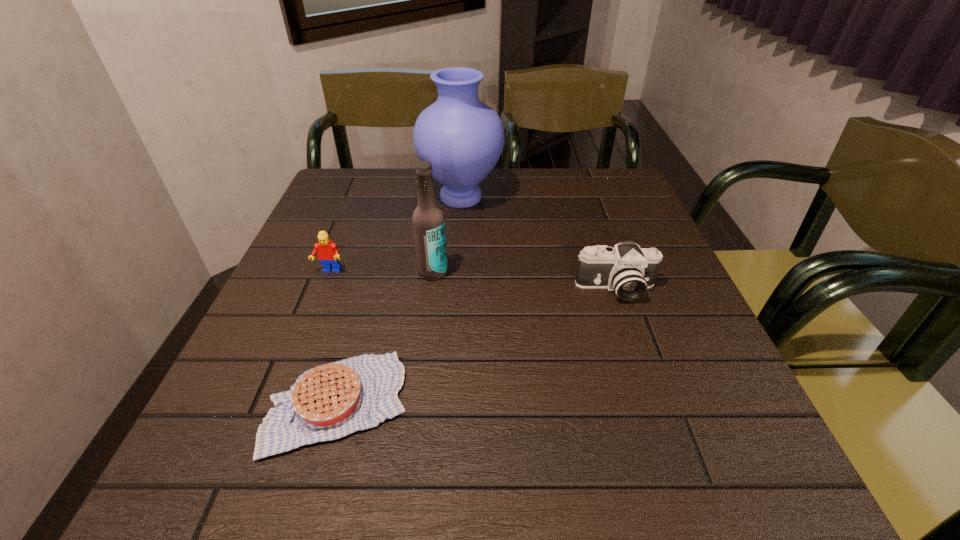
Find the location of `empty space between the fourth shortest object and the Lego`. empty space between the fourth shortest object and the Lego is located at coordinates (381, 272).

You are a GUI agent. You are given a task and a screenshot of the screen. Output one action in this format:
    pyautogui.click(x=<x>, y=<y>)
    Task: Click on the vacant space that's between the tallest object and the Lego
    The width and height of the screenshot is (960, 540).
    Given the screenshot: What is the action you would take?
    pyautogui.click(x=396, y=234)

The height and width of the screenshot is (540, 960). I want to click on unoccupied position between the nearest object and the tallest object, so point(399,300).

Locate which object is the third closest to the nearest object. Please provide its 2D coordinates. Your answer should be formatted as a tuple, i.e. [(x, y)], where the tuple contains the x and y coordinates of a point satisfying the conditions above.

[(628, 270)]

Locate which object ranks fourth in proximity to the camera. Please provide its 2D coordinates. Your answer should be formatted as a tuple, i.e. [(x, y)], where the tuple contains the x and y coordinates of a point satisfying the conditions above.

[(328, 253)]

Where is `vacant space that satisfies the following two spatial constraints: 1. on the front-facing side of the rightmost object; 2. on the right side of the Lego`? vacant space that satisfies the following two spatial constraints: 1. on the front-facing side of the rightmost object; 2. on the right side of the Lego is located at coordinates (323, 289).

Locate an element on the screen. free space that satisfies the following two spatial constraints: 1. on the back side of the nearest object; 2. on the right side of the vase is located at coordinates (396, 197).

The width and height of the screenshot is (960, 540). I want to click on free space that satisfies the following two spatial constraints: 1. on the front-facing side of the Lego; 2. on the right side of the shortest object, so click(x=277, y=403).

Where is `free space that satisfies the following two spatial constraints: 1. on the label of the beer bottle; 2. on the right side of the rightmost object`? This screenshot has width=960, height=540. free space that satisfies the following two spatial constraints: 1. on the label of the beer bottle; 2. on the right side of the rightmost object is located at coordinates (431, 289).